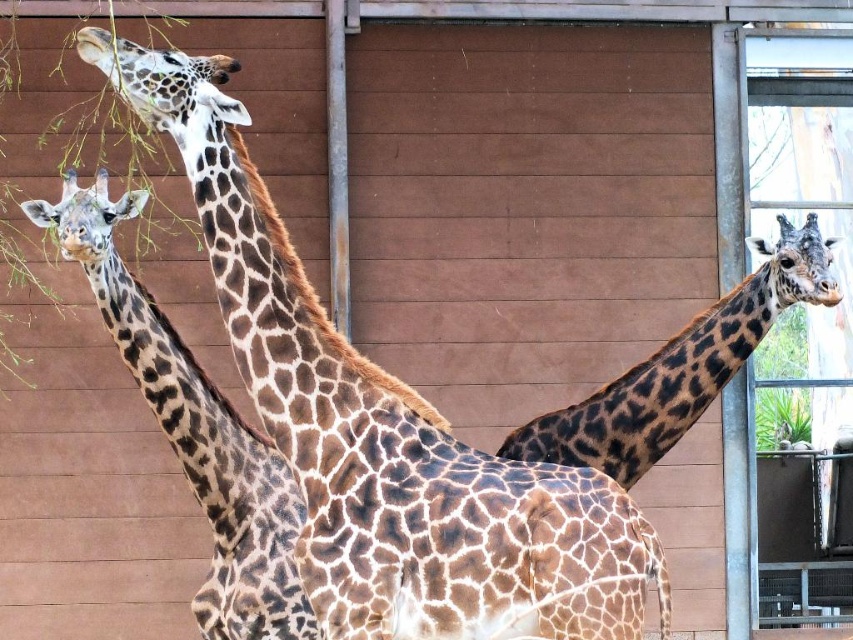
Between brown spotted giraffe at upper left and brown spotted giraffe at left, which one is positioned higher?

brown spotted giraffe at upper left

Is point (471, 632) behind point (193, 598)?

No, it is in front of (193, 598).

Which is in front, point (590, 557) or point (216, 460)?

Point (590, 557) is in front.

Where is `brown spotted giraffe at upper left`? This screenshot has width=853, height=640. brown spotted giraffe at upper left is located at coordinates (383, 429).

Can you confirm if brown spotted giraffe at upper left is positioned to the right of spotted fur giraffe at right?

In fact, brown spotted giraffe at upper left is to the left of spotted fur giraffe at right.

Between brown spotted giraffe at upper left and spotted fur giraffe at right, which one has less height?

With less height is spotted fur giraffe at right.

Does point (386, 428) lie in front of point (680, 356)?

Yes, point (386, 428) is in front of point (680, 356).

This screenshot has height=640, width=853. Identify the location of brown spotted giraffe at upper left. (383, 429).

Which of these two, brown spotted giraffe at left or spotted fur giraffe at right, stands taller?

brown spotted giraffe at left

Image resolution: width=853 pixels, height=640 pixels. In order to click on brown spotted giraffe at left in this screenshot , I will do `click(194, 432)`.